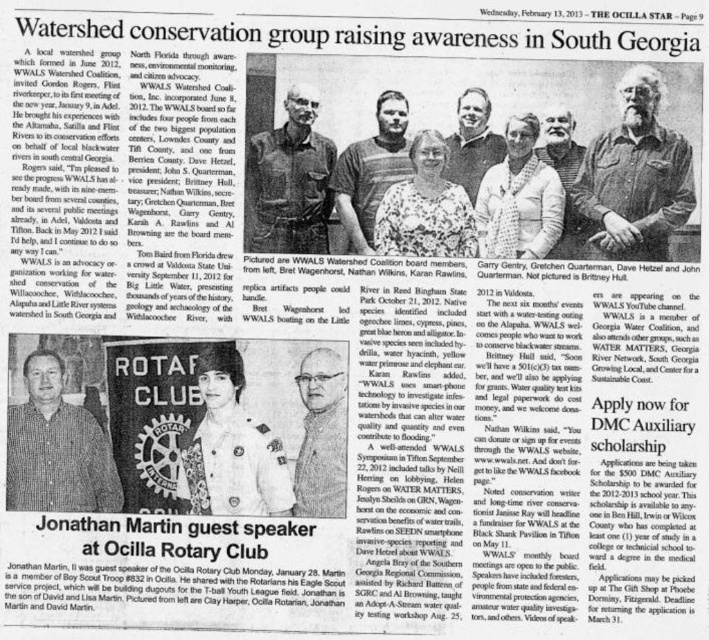
Based on the newspaper clipping from The Ocilla Star, February 13, 2013, which object at the center has a greater width between the gray hair at center and the white beard at center?

The gray hair at center has a greater width than the white beard at center according to the description.